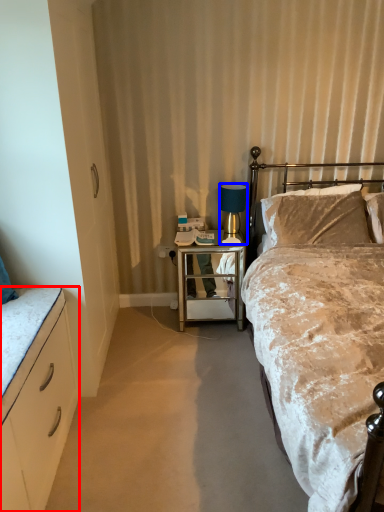
Question: Which point is further to the camera, cabinetry (highlighted by a red box) or lamp (highlighted by a blue box)?

Choices:
 (A) cabinetry
 (B) lamp

Answer: (B)